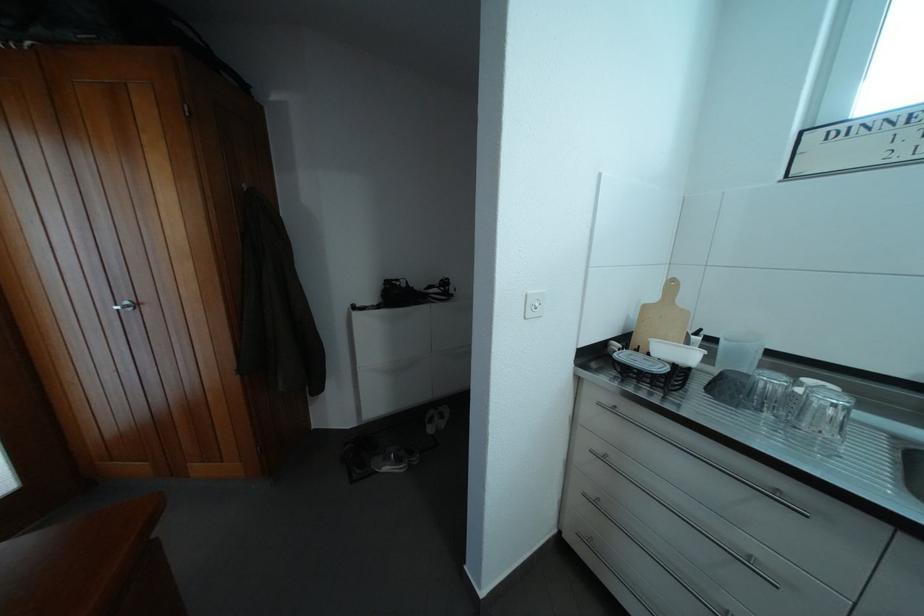
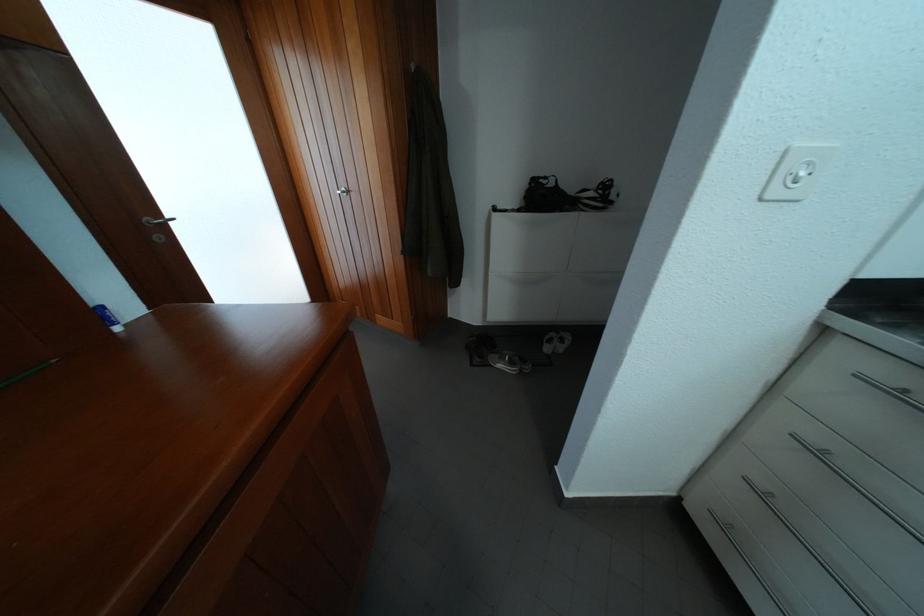
In the second image, find the point that corresponds to the point at 613,464 in the first image.

(829, 460)